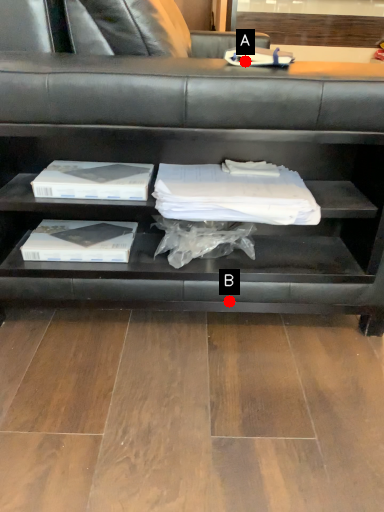
Question: Two points are circled on the image, labeled by A and B beside each circle. Among these points, which one is farthest from the camera?

Choices:
 (A) A is further
 (B) B is further

Answer: (A)